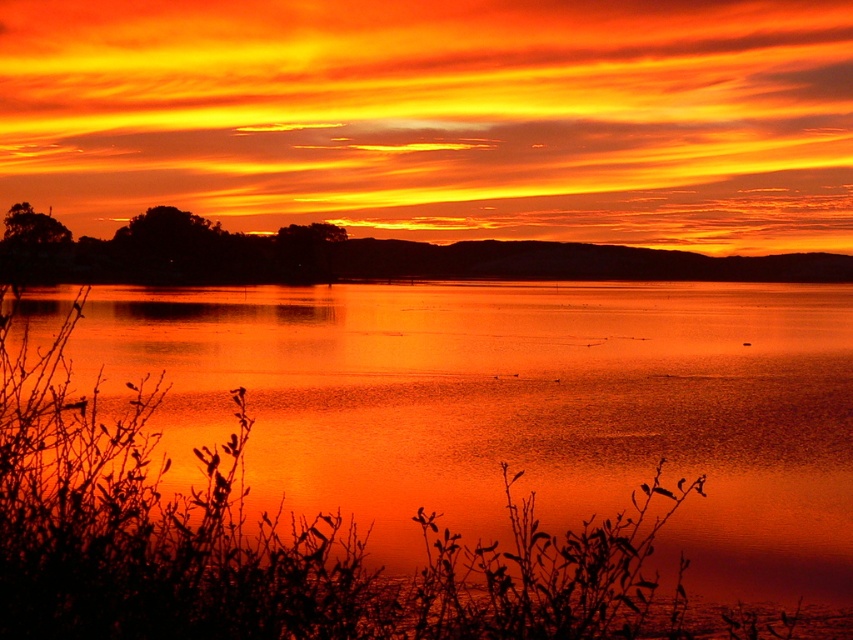
You are an artist trying to paint the sunset scene. You notice both the matte orange water at center and the matte orange sky at center. Which one of these two elements has a larger area in the painting?

The matte orange sky at center has a larger area than the matte orange water at center in the painting.

From the picture: You are standing at the lakeside and looking at the scene. Which object, the matte orange water at center or the matte orange sky at center, appears nearer to you?

The matte orange water at center appears nearer to you because it is closer to the viewer than the matte orange sky at center according to the spatial arrangement in the scene.

You are an artist trying to paint this sunset scene. You notice the matte orange water at center and the matte orange sky at center. Which one appears larger in height in the painting?

The matte orange water at center is much taller than the matte orange sky at center in the painting.